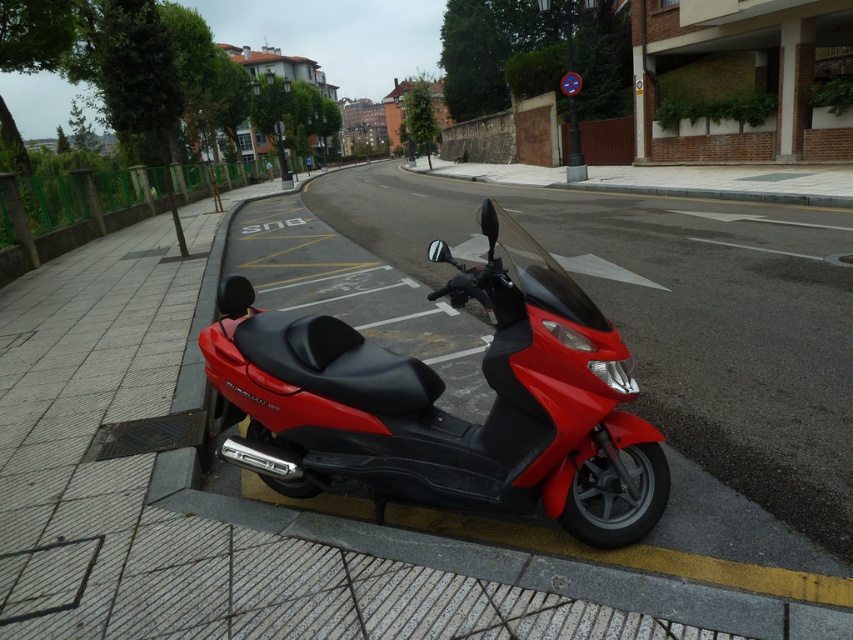
Between matte black pavement at center and matte red scooter at center, which one has less height?

matte red scooter at center

Who is more forward, (65, 577) or (650, 472)?

Point (65, 577) is in front.

Identify the location of matte black pavement at center. Image resolution: width=853 pixels, height=640 pixels. (259, 502).